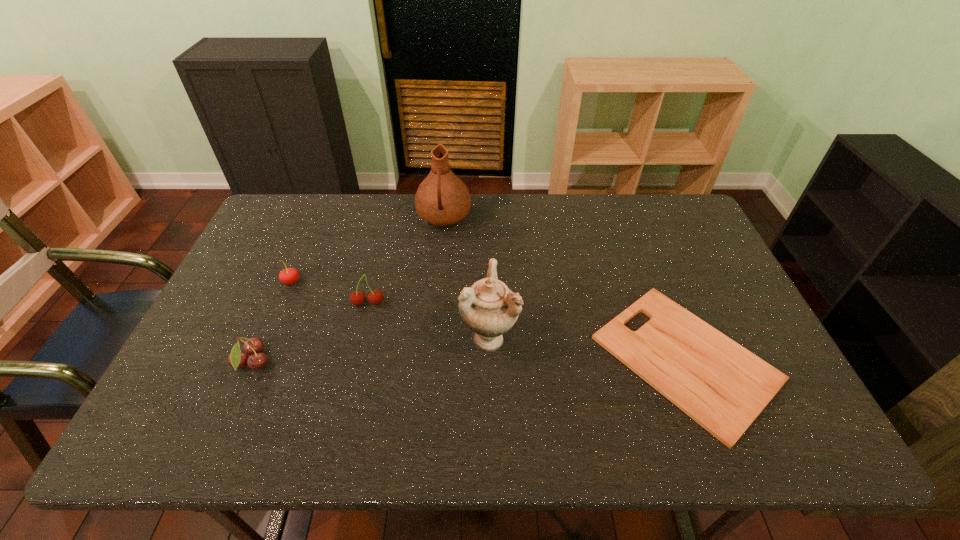
Where is `free space located 0.330m on the surface of the rightmost cherry`? free space located 0.330m on the surface of the rightmost cherry is located at coordinates (x=340, y=423).

Image resolution: width=960 pixels, height=540 pixels. Find the location of `free location located 0.120m on the right of the farthest cherry`. free location located 0.120m on the right of the farthest cherry is located at coordinates (342, 282).

You are a GUI agent. You are given a task and a screenshot of the screen. Output one action in this format:
    pyautogui.click(x=<x>, y=<y>)
    Task: Click on the free location located on the leaves of the nearest cherry
    The width and height of the screenshot is (960, 540).
    Given the screenshot: What is the action you would take?
    pyautogui.click(x=433, y=363)

Locate an element on the screen. This screenshot has height=540, width=960. vacant space located on the left of the shortest object is located at coordinates (548, 359).

The height and width of the screenshot is (540, 960). I want to click on object that is at the far edge, so click(x=442, y=199).

This screenshot has height=540, width=960. I want to click on object that is positioned at the near edge, so click(x=721, y=385).

Where is `object present at the right edge`? The width and height of the screenshot is (960, 540). object present at the right edge is located at coordinates 721,385.

Where is `object that is at the near right corner`? The width and height of the screenshot is (960, 540). object that is at the near right corner is located at coordinates (721, 385).

Identify the location of vacant region at the far edge of the desktop. The image size is (960, 540). click(x=485, y=195).

The width and height of the screenshot is (960, 540). In the image, there is a desktop. In order to click on free space at the near edge in this screenshot , I will do `click(490, 416)`.